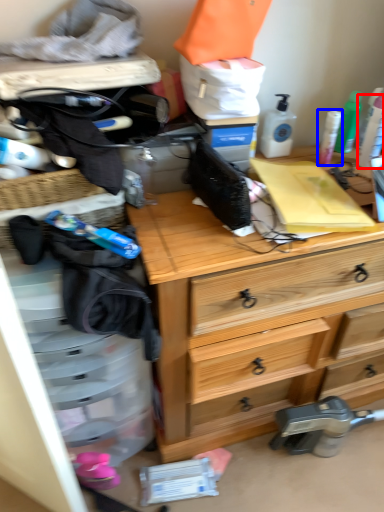
Question: Which point is closer to the camera, toiletry (highlighted by a red box) or toiletry (highlighted by a blue box)?

Choices:
 (A) toiletry
 (B) toiletry

Answer: (A)